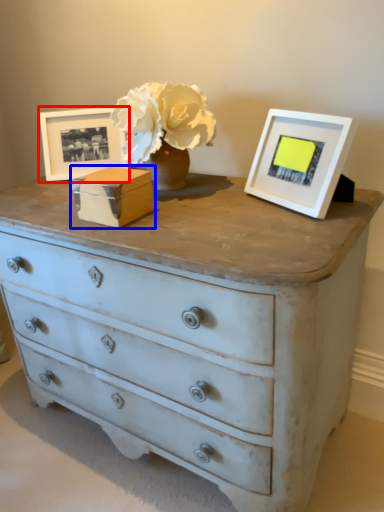
Question: Among these objects, which one is nearest to the camera, picture frame (highlighted by a red box) or box (highlighted by a blue box)?

Choices:
 (A) picture frame
 (B) box

Answer: (B)